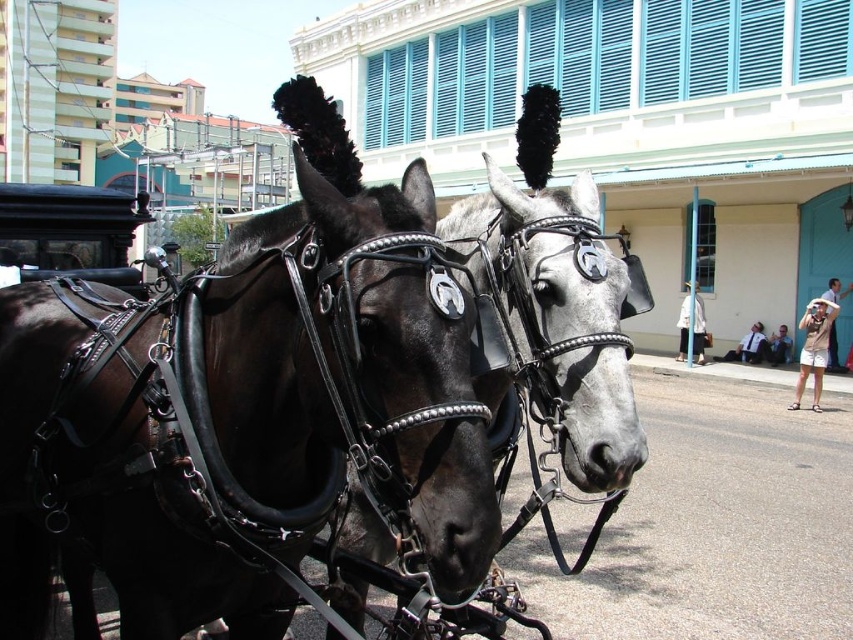
Is black leather horse at center above light blue denim jacket at lower right?

Indeed, black leather horse at center is positioned over light blue denim jacket at lower right.

The width and height of the screenshot is (853, 640). What are the coordinates of `black leather horse at center` in the screenshot? It's located at (596, 417).

Which is below, shiny black harness at center or black leather horse at center?

shiny black harness at center is lower down.

Measure the distance between shiny black harness at center and camera.

They are 1.88 meters apart.

Is point (56, 470) more distant than point (486, 248)?

Yes, it is.

The height and width of the screenshot is (640, 853). I want to click on shiny black harness at center, so click(346, 372).

What do you see at coordinates (814, 348) in the screenshot? Image resolution: width=853 pixels, height=640 pixels. I see `tan shorts at lower right` at bounding box center [814, 348].

Between tan shorts at lower right and light blue denim jacket at lower right, which one is positioned higher?

light blue denim jacket at lower right is above.

Is point (815, 385) positioned after point (770, 353)?

No, (815, 385) is closer to viewer.

Identify the location of tan shorts at lower right. (814, 348).